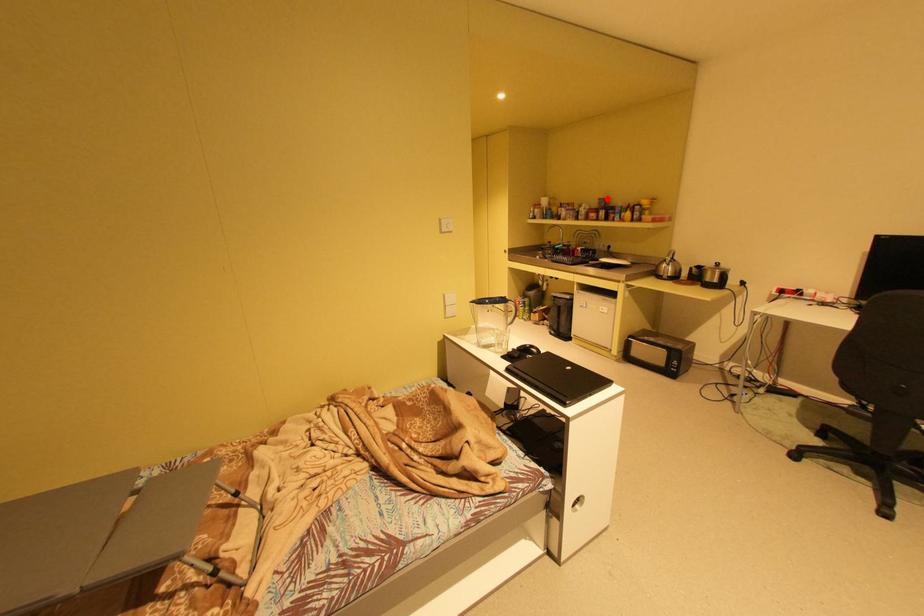
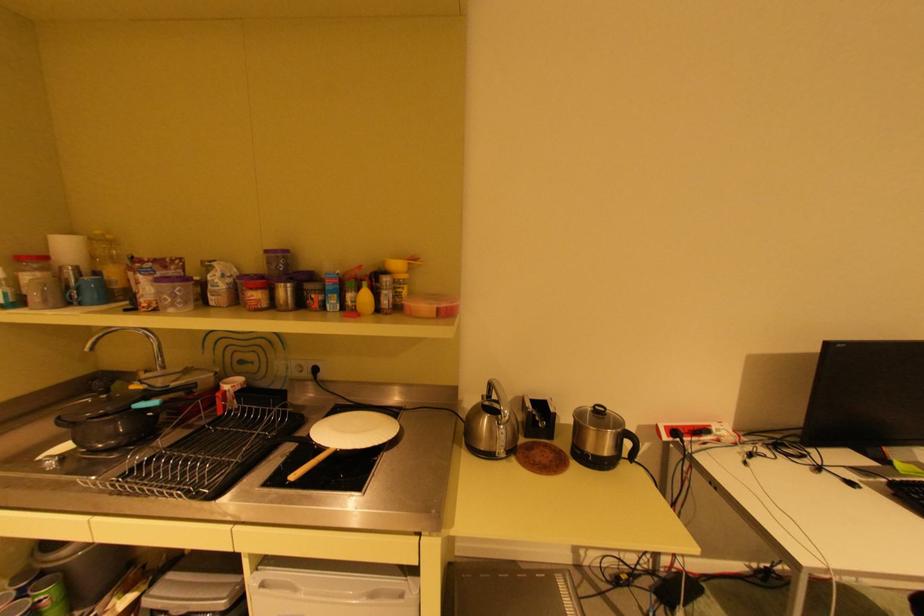
Question: I am providing you with two images of the same scene from different viewpoints. Given a red point in image1, look at the same physical point in image2. Is it:

Choices:
 (A) Closer to the viewpoint
 (B) Farther from the viewpoint

Answer: (B)